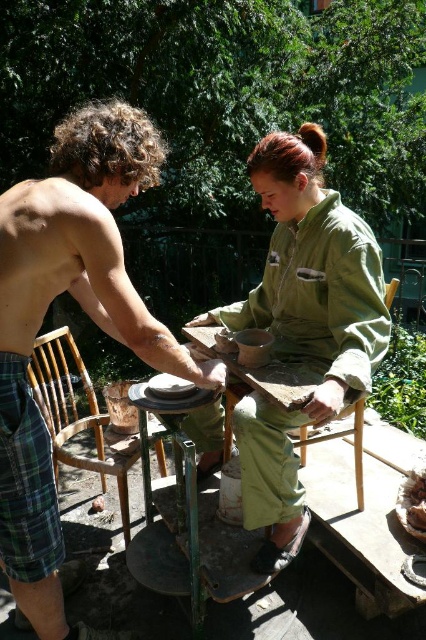
Is wooden chair at center closer to camera compared to brown crumbly bread at lower right?

Yes, it is in front of brown crumbly bread at lower right.

Which is more to the left, wooden chair at center or brown crumbly bread at lower right?

wooden chair at center is more to the left.

Locate an element on the screen. This screenshot has width=426, height=640. wooden chair at center is located at coordinates (336, 436).

Find the location of a particular element. Image resolution: width=426 pixels, height=640 pixels. wooden chair at center is located at coordinates (336, 436).

Does shiny metallic potter's wheel at center have a lesser height compared to wooden chair at left?

Incorrect, shiny metallic potter's wheel at center's height does not fall short of wooden chair at left's.

Is shiny metallic potter's wheel at center to the left of wooden chair at left from the viewer's perspective?

In fact, shiny metallic potter's wheel at center is to the right of wooden chair at left.

Who is more forward, (25, 289) or (43, 342)?

Point (25, 289) is in front.

The width and height of the screenshot is (426, 640). What are the coordinates of `shiny metallic potter's wheel at center` in the screenshot? It's located at (83, 310).

Between point (9, 413) and point (71, 422), which one is positioned behind?

The point (71, 422) is more distant.

Is green plaid shorts at lower left positioned behind wooden chair at left?

No, green plaid shorts at lower left is in front of wooden chair at left.

Locate an element on the screen. The width and height of the screenshot is (426, 640). green plaid shorts at lower left is located at coordinates (25, 480).